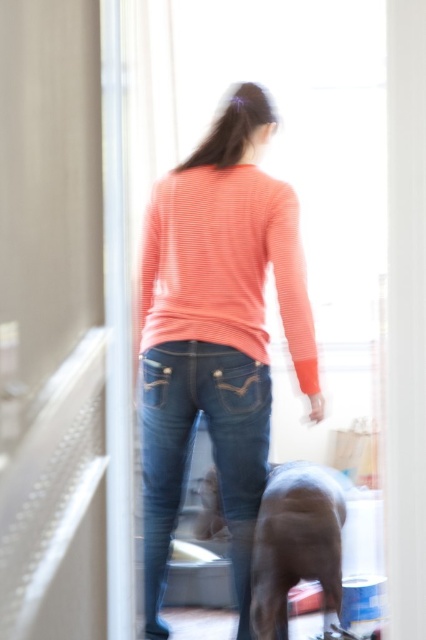
Is coral striped sweater at center closer to the viewer compared to shiny brown dog at lower center?

No, coral striped sweater at center is further to the viewer.

Identify the location of coral striped sweater at center. (224, 264).

Can you confirm if matte coral sweater at center is wider than shiny brown dog at lower center?

Correct, the width of matte coral sweater at center exceeds that of shiny brown dog at lower center.

Is matte coral sweater at center further to camera compared to shiny brown dog at lower center?

Yes, matte coral sweater at center is behind shiny brown dog at lower center.

This screenshot has height=640, width=426. Describe the element at coordinates (216, 332) in the screenshot. I see `matte coral sweater at center` at that location.

Identify the location of matte coral sweater at center. (216, 332).

Which is more to the right, matte coral sweater at center or coral striped sweater at center?

coral striped sweater at center

Does point (236, 577) lie behind point (290, 221)?

Yes, it is.

Where is `matte coral sweater at center`? Image resolution: width=426 pixels, height=640 pixels. matte coral sweater at center is located at coordinates (216, 332).